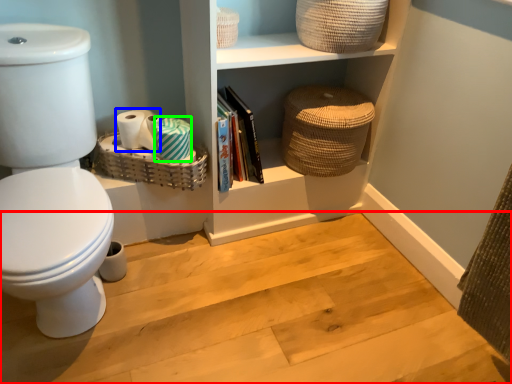
Question: Which is nearer to the stair (highlighted by a red box)? toilet paper (highlighted by a blue box) or toilet paper (highlighted by a green box).

Choices:
 (A) toilet paper
 (B) toilet paper

Answer: (B)